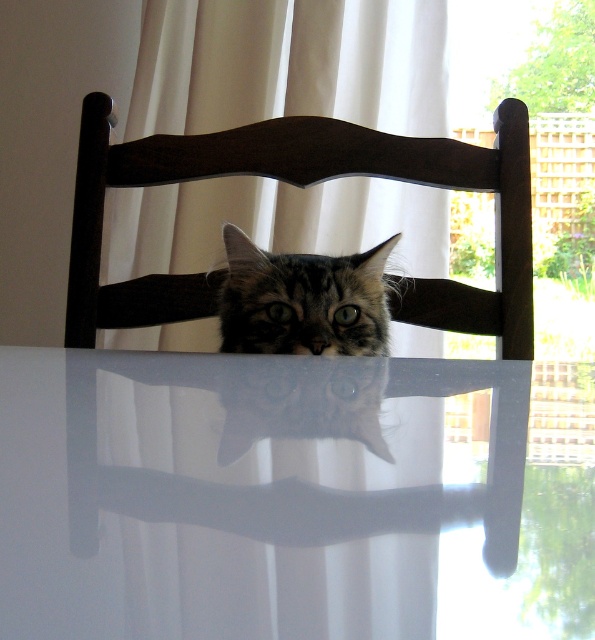
Question: Is white glossy table at center smaller than dark wood chair at center?

Choices:
 (A) yes
 (B) no

Answer: (A)

Question: Which point is closer to the camera?

Choices:
 (A) tabby fur cat at center
 (B) white glossy table at center
 (C) dark wood chair at center

Answer: (B)

Question: Which object appears farthest from the camera in this image?

Choices:
 (A) dark wood chair at center
 (B) tabby fur cat at center

Answer: (A)

Question: Observing the image, what is the correct spatial positioning of white glossy table at center in reference to dark wood chair at center?

Choices:
 (A) left
 (B) right

Answer: (B)

Question: Estimate the real-world distances between objects in this image. Which object is closer to the dark wood chair at center?

Choices:
 (A) white glossy table at center
 (B) tabby fur cat at center

Answer: (B)

Question: Can you confirm if white glossy table at center is wider than tabby fur cat at center?

Choices:
 (A) yes
 (B) no

Answer: (A)